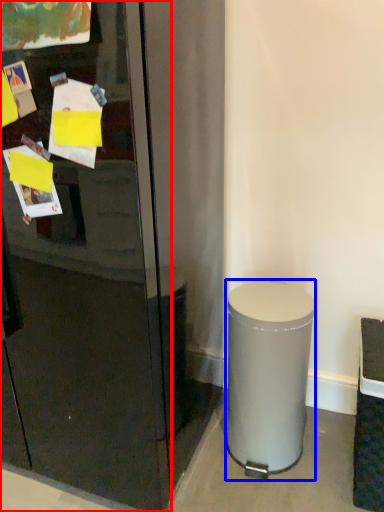
Question: Which object is closer to the camera taking this photo, glass door (highlighted by a red box) or trash bin/can (highlighted by a blue box)?

Choices:
 (A) glass door
 (B) trash bin/can

Answer: (A)